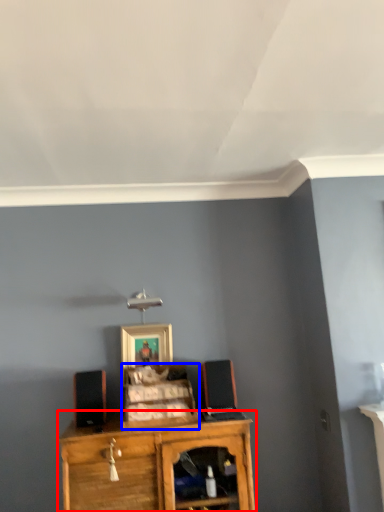
Question: Which object is further to the camera taking this photo, shelf (highlighted by a red box) or cabinet (highlighted by a blue box)?

Choices:
 (A) shelf
 (B) cabinet

Answer: (B)